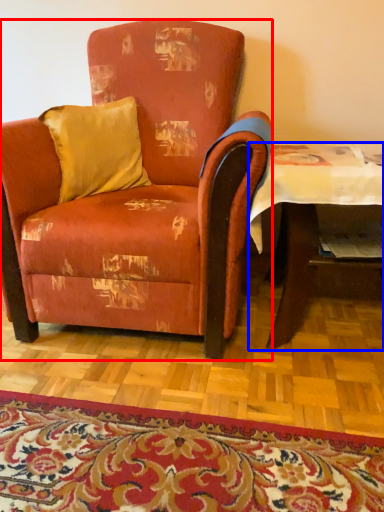
Question: Which point is further to the camera, chair (highlighted by a red box) or table (highlighted by a blue box)?

Choices:
 (A) chair
 (B) table

Answer: (B)